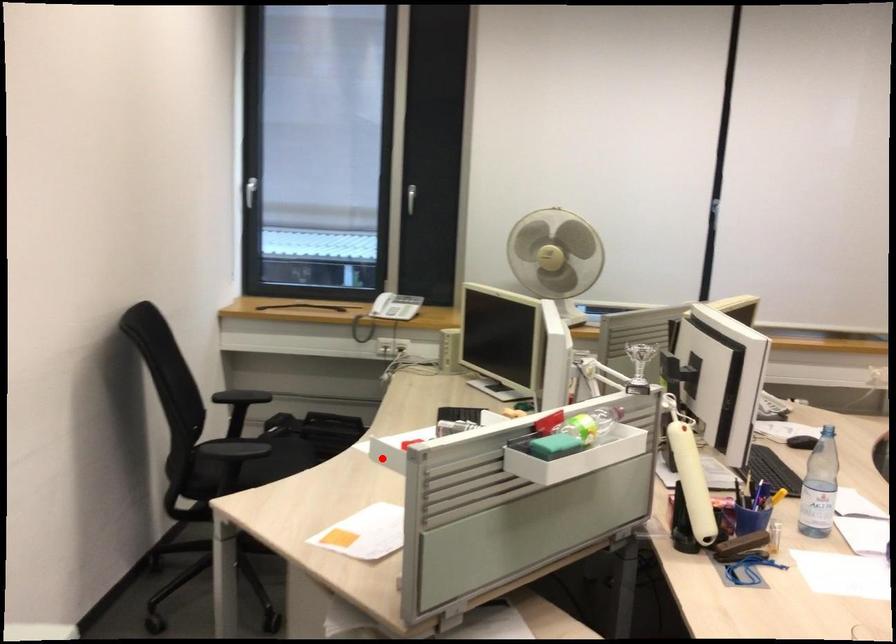
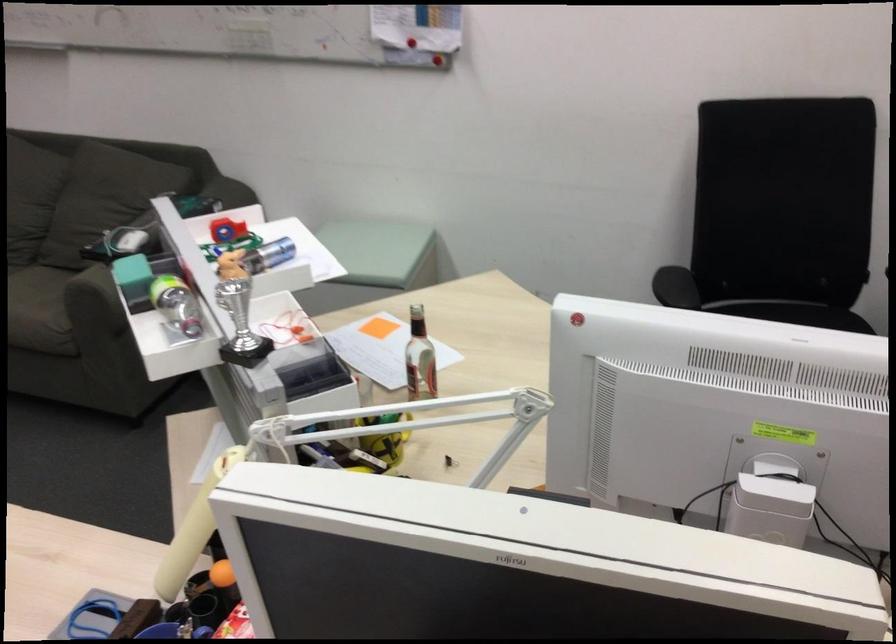
Locate, in the second image, the point that corresponds to the highlighted location in the first image.

(221, 230)